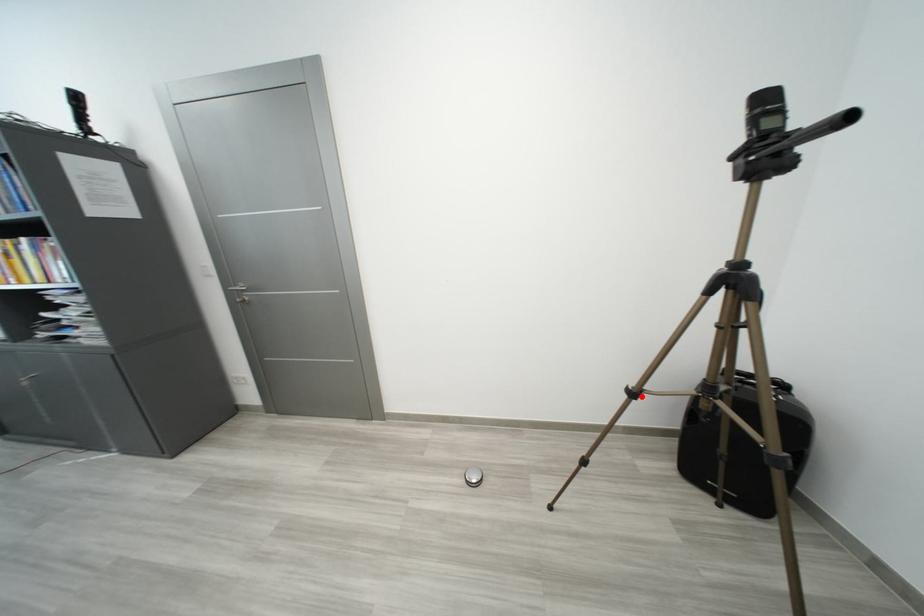
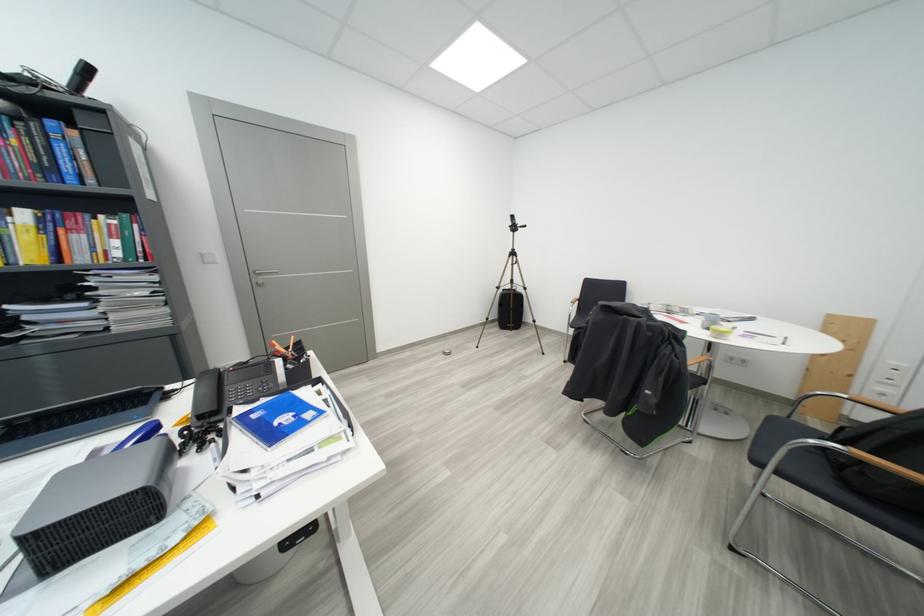
Locate, in the second image, the point that corresponds to the highlighted location in the first image.

(506, 291)